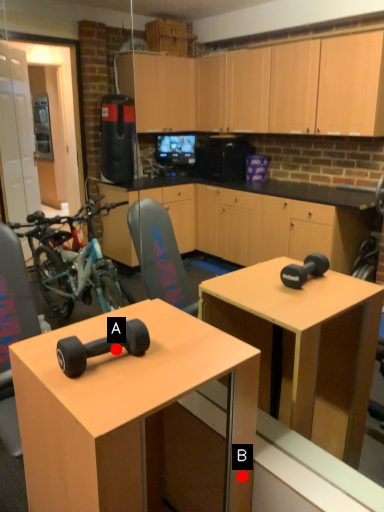
Question: Two points are circled on the image, labeled by A and B beside each circle. Which point appears farthest from the camera in this image?

Choices:
 (A) A is further
 (B) B is further

Answer: (B)